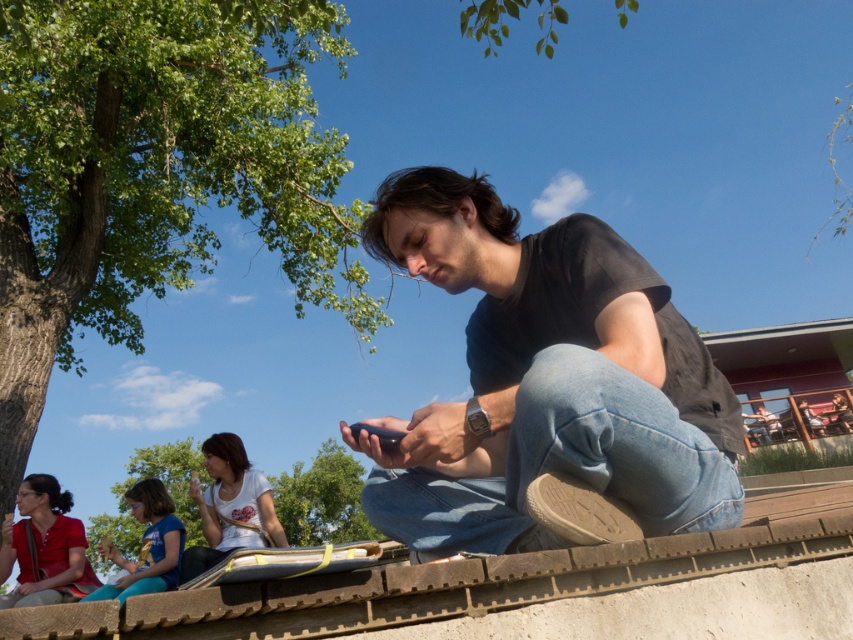
Which is in front, point (608, 320) or point (161, 536)?

Positioned in front is point (608, 320).

What do you see at coordinates (544, 380) in the screenshot?
I see `black matte shirt at center` at bounding box center [544, 380].

Identify the location of black matte shirt at center. The height and width of the screenshot is (640, 853). (544, 380).

Which of these two, green leafy tree at lower left or white matte shirt at lower left, stands taller?

green leafy tree at lower left is taller.

Does green leafy tree at lower left have a lesser height compared to white matte shirt at lower left?

No.

Does point (189, 440) come in front of point (207, 561)?

No, it is not.

Image resolution: width=853 pixels, height=640 pixels. I want to click on green leafy tree at lower left, so (x=322, y=499).

Who is positioned more to the left, green leafy tree at lower left or matte red shirt at lower left?

Positioned to the left is green leafy tree at lower left.

What are the coordinates of `green leafy tree at lower left` in the screenshot? It's located at (322, 499).